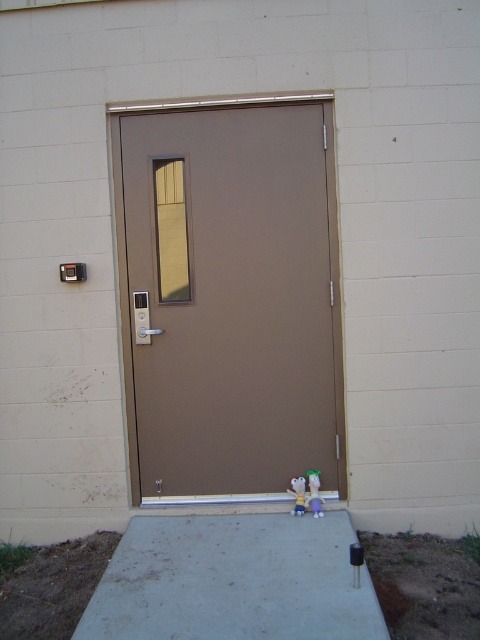
You are a delivery person who needs to place a package between the purple fabric toy at lower center and the plush green at lower center. Can you fit the package if it measures 2 inches in width?

The distance between the purple fabric toy at lower center and the plush green at lower center is 2.13 inches. Since the package is 2 inches wide, it can fit between them.

You are standing in front of the door and need to move the two plush toys so they are closer together. The yellow plush toy is at point (x=165, y=339) and the purple plush toy is at point 0.456, 0.672. How much distance do you need to reduce between them to make them 2 meters apart?

The current distance between the yellow plush toy at point (x=165, y=339) and the purple plush toy at point 0.456, 0.672 is 4.23 meters. To make them 2 meters apart, you need to reduce the distance by 2.23 meters.